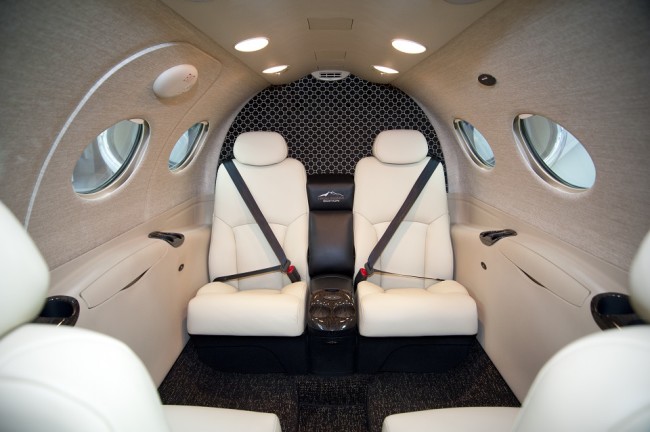
Find any where you'd sit in the picture. Your answer should be formatted as a list of tuples, i.e. [(x1, y1), (x2, y2), ...], where each tuple contains the x and y coordinates of a point satisfying the conditions above.

[(249, 302), (430, 302)]